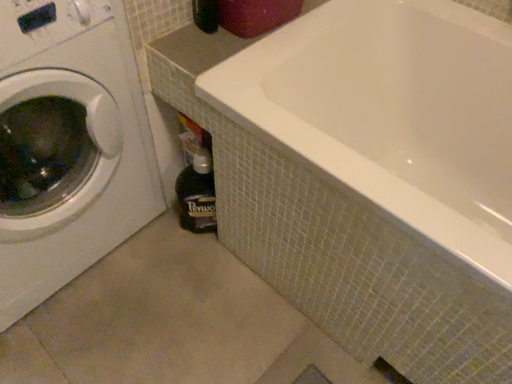
Question: Would you say dark brown glass bottle at lower center is outside white glossy washing machine at left?

Choices:
 (A) no
 (B) yes

Answer: (B)

Question: Is dark brown glass bottle at lower center far away from white glossy washing machine at left?

Choices:
 (A) no
 (B) yes

Answer: (A)

Question: Considering the relative positions of dark brown glass bottle at lower center and white glossy washing machine at left in the image provided, is dark brown glass bottle at lower center behind white glossy washing machine at left?

Choices:
 (A) yes
 (B) no

Answer: (A)

Question: Is white glossy washing machine at left completely or partially inside dark brown glass bottle at lower center?

Choices:
 (A) yes
 (B) no

Answer: (B)

Question: Can you confirm if dark brown glass bottle at lower center is bigger than white glossy washing machine at left?

Choices:
 (A) no
 (B) yes

Answer: (A)

Question: From the image's perspective, is white glossy washing machine at left positioned above or below white glossy bathtub at center?

Choices:
 (A) below
 (B) above

Answer: (B)

Question: From a real-world perspective, is white glossy washing machine at left above or below white glossy bathtub at center?

Choices:
 (A) above
 (B) below

Answer: (A)

Question: Based on their positions, is white glossy washing machine at left located to the left or right of white glossy bathtub at center?

Choices:
 (A) right
 (B) left

Answer: (B)

Question: Is point (123, 145) positioned closer to the camera than point (267, 59)?

Choices:
 (A) closer
 (B) farther

Answer: (B)

Question: Is point (210, 180) closer or farther from the camera than point (228, 112)?

Choices:
 (A) farther
 (B) closer

Answer: (A)

Question: From the image's perspective, is dark brown glass bottle at lower center above or below white glossy bathtub at center?

Choices:
 (A) below
 (B) above

Answer: (A)

Question: In the image, is dark brown glass bottle at lower center positioned in front of or behind white glossy bathtub at center?

Choices:
 (A) behind
 (B) front

Answer: (A)

Question: In terms of size, does dark brown glass bottle at lower center appear bigger or smaller than white glossy bathtub at center?

Choices:
 (A) small
 (B) big

Answer: (A)

Question: Is white glossy washing machine at left inside the boundaries of dark brown glass bottle at lower center, or outside?

Choices:
 (A) inside
 (B) outside

Answer: (B)

Question: In the image, is white glossy washing machine at left positioned in front of or behind dark brown glass bottle at lower center?

Choices:
 (A) front
 (B) behind

Answer: (A)